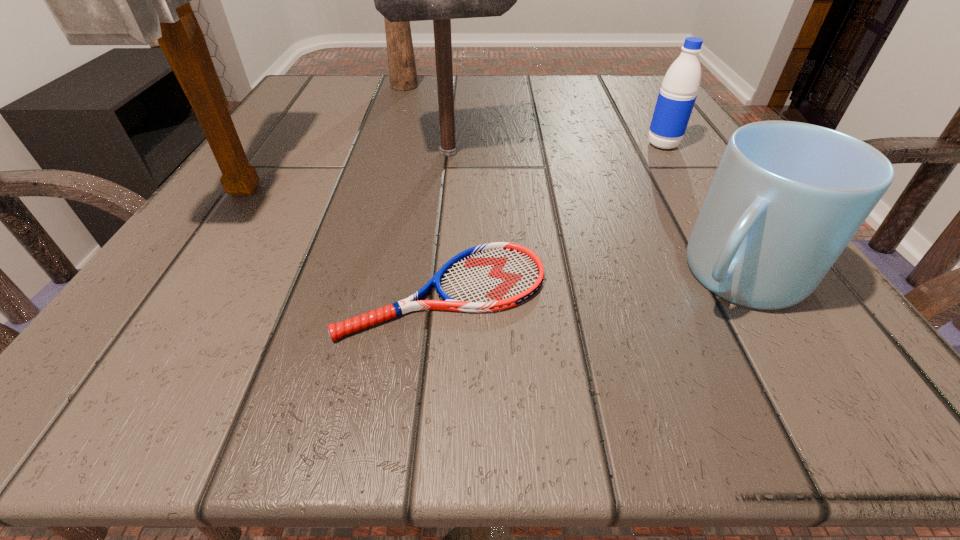
At what (x,y) coordinates should I click in order to perform the action: click on object that is the second closest to the farthest object. Please return your answer as a coordinate pair (x, y). Looking at the image, I should click on (96, 0).

Locate an element on the screen. mallet object that ranks as the closest to the farthest mallet is located at coordinates (399, 0).

Image resolution: width=960 pixels, height=540 pixels. In order to click on mallet that is the second closest to the mug in this screenshot , I will do `click(96, 0)`.

Find the location of `free region that satisfies the following two spatial constraints: 1. on the front side of the water bottle; 2. on the left side of the farthest mallet`. free region that satisfies the following two spatial constraints: 1. on the front side of the water bottle; 2. on the left side of the farthest mallet is located at coordinates (384, 145).